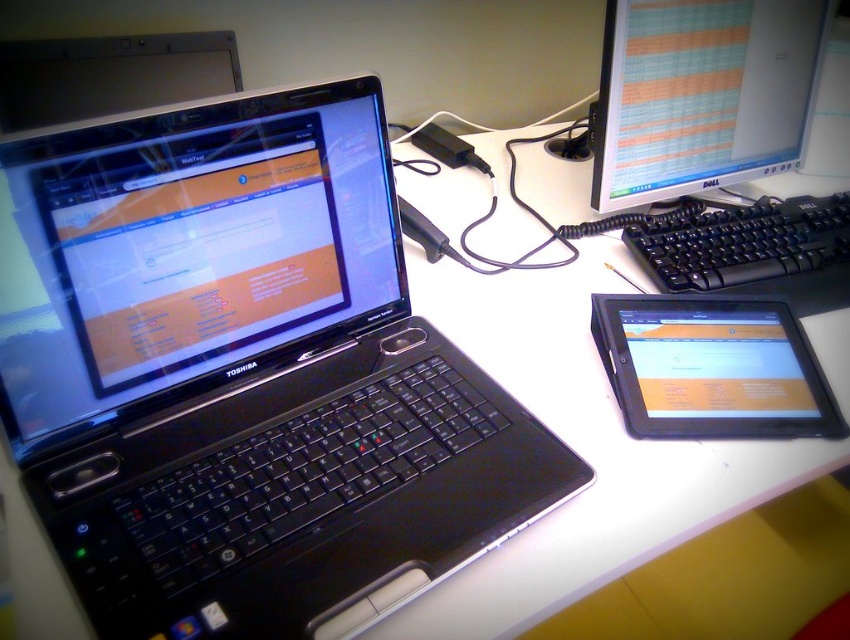
You are setting up a new monitor and keyboard on your desk. You want to place the matte plastic monitor at upper right and the black plastic keyboard at right such that the monitor is above the keyboard. Is this arrangement possible given their sizes?

The matte plastic monitor at upper right has a greater height compared to black plastic keyboard at right, so arranging the matte plastic monitor at upper right above the black plastic keyboard at right is possible since the monitor is taller than the keyboard.

You are setting up a new desk arrangement and want to place a plant between the matte plastic monitor at upper right and the black plastic keyboard at right. Based on their positions, where should you place the plant?

The matte plastic monitor at upper right is located above the black plastic keyboard at right, so you should place the plant between them in the vertical space between the monitor and the keyboard.

You are a delivery person who just arrived at a modern office. You need to place a new monitor at point (701, 93). However, there is already an object there. What is the object at that point?

The object at point (701, 93) is a matte plastic monitor at upper right.